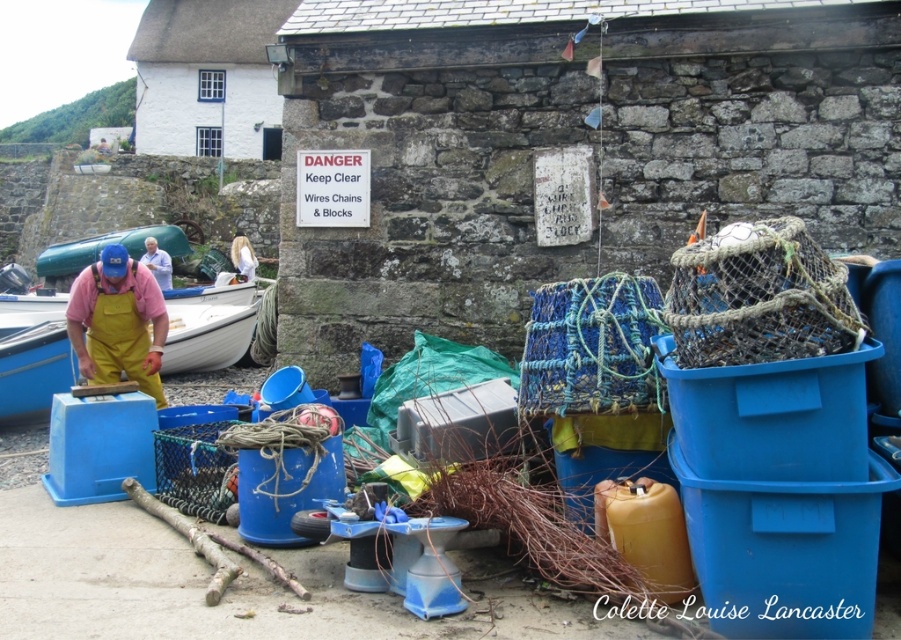
In the scene shown: Who is positioned more to the right, blue fabric at center or white fabric shirt at center?

white fabric shirt at center is more to the right.

Which is more to the left, blue fabric at center or white fabric shirt at center?

blue fabric at center is more to the left.

Locate an element on the screen. blue fabric at center is located at coordinates (157, 262).

Who is more distant from viewer, (161,317) or (158,259)?

Point (158,259)

Is point (98, 378) positioned before point (168, 253)?

Yes.

At what (x,y) coordinates should I click in order to perform the action: click on yellow rubber overalls at left. Please return your answer as a coordinate pair (x, y). The width and height of the screenshot is (901, 640). Looking at the image, I should click on (117, 321).

Based on the photo, does green plastic boat at upper left appear on the left side of blue fabric at center?

Indeed, green plastic boat at upper left is positioned on the left side of blue fabric at center.

At what (x,y) coordinates should I click in order to perform the action: click on green plastic boat at upper left. Please return your answer as a coordinate pair (x, y). Looking at the image, I should click on (105, 244).